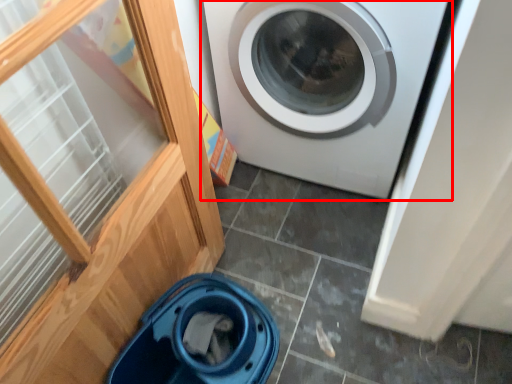
Question: Observing the image, what is the correct spatial positioning of washing machine (annotated by the red box) in reference to dish washer?

Choices:
 (A) right
 (B) left

Answer: (A)